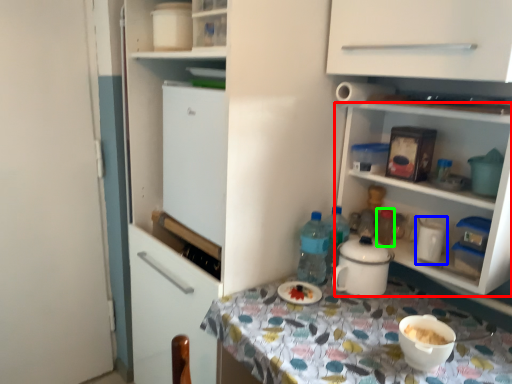
Question: Based on their relative distances, which object is farther from shelf (highlighted by a red box)? Choose from appliance (highlighted by a blue box) and bottle (highlighted by a green box).

Choices:
 (A) appliance
 (B) bottle

Answer: (B)